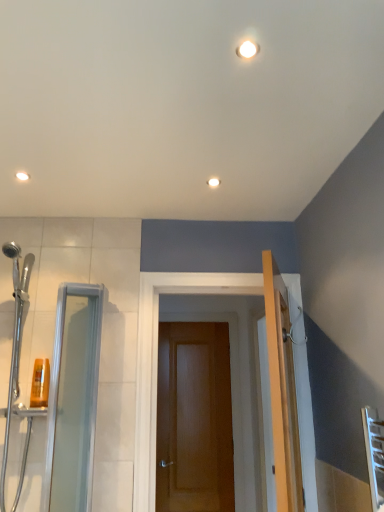
Question: From the image's perspective, is wooden door at center above or below transparent glass shower door at left?

Choices:
 (A) below
 (B) above

Answer: (A)

Question: In the image, is wooden door at center positioned in front of or behind transparent glass shower door at left?

Choices:
 (A) behind
 (B) front

Answer: (A)

Question: Which of these objects is positioned closest to the translucent plastic shampoo bottle at left?

Choices:
 (A) clear glass screen door at left
 (B) white glossy light fixture at upper center
 (C) transparent glass shower door at left
 (D) wooden door at center

Answer: (A)

Question: Which is nearer to the translucent plastic shampoo bottle at left?

Choices:
 (A) clear glass screen door at left
 (B) wooden door at center
 (C) transparent glass shower door at left
 (D) white glossy light fixture at upper center

Answer: (A)